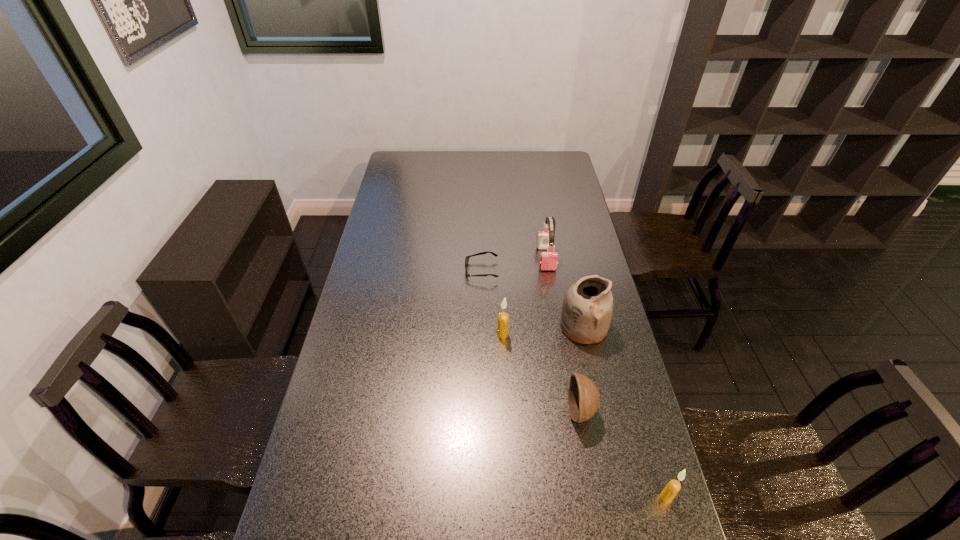
This screenshot has height=540, width=960. What are the coordinates of `blank space that satisfies the following two spatial constraints: 1. on the lenses of the sunglasses; 2. on the left side of the shorter candle` in the screenshot? It's located at (482, 497).

The height and width of the screenshot is (540, 960). What are the coordinates of `free space that satisfies the following two spatial constraints: 1. on the lenses of the farther candle; 2. on the right side of the shortest object` in the screenshot? It's located at (482, 334).